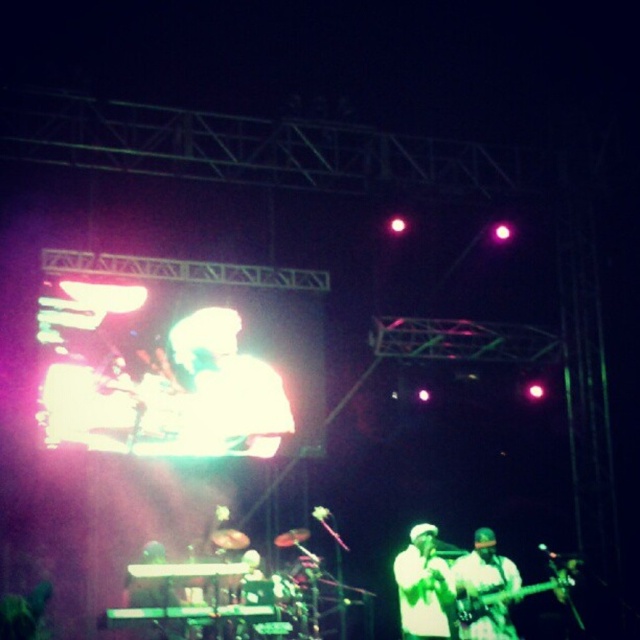
Question: Which object appears farthest from the camera in this image?

Choices:
 (A) metallic guitar at lower right
 (B) white matte guitar at lower right

Answer: (B)

Question: Is white matte shirt at center to the left of white matte guitar at lower right from the viewer's perspective?

Choices:
 (A) no
 (B) yes

Answer: (B)

Question: Which point is farther from the camera taking this photo?

Choices:
 (A) (515, 598)
 (B) (412, 540)
 (C) (456, 566)

Answer: (B)

Question: Is white matte shirt at center to the left of metallic guitar at lower right from the viewer's perspective?

Choices:
 (A) yes
 (B) no

Answer: (A)

Question: Can you confirm if white matte shirt at center is positioned above metallic guitar at lower right?

Choices:
 (A) no
 (B) yes

Answer: (B)

Question: Among these objects, which one is nearest to the camera?

Choices:
 (A) white matte guitar at lower right
 (B) metallic guitar at lower right
 (C) white matte shirt at center

Answer: (B)